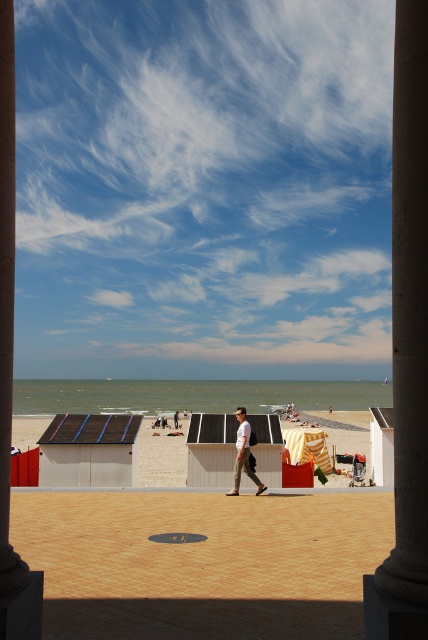
Who is taller, smooth concrete pillar at left or light brown leather pants at center?

Standing taller between the two is smooth concrete pillar at left.

Is smooth concrete pillar at left shorter than light brown leather pants at center?

In fact, smooth concrete pillar at left may be taller than light brown leather pants at center.

The height and width of the screenshot is (640, 428). In order to click on smooth concrete pillar at left in this screenshot , I will do `click(11, 364)`.

The image size is (428, 640). In order to click on smooth concrete pillar at left in this screenshot , I will do `click(11, 364)`.

Can you confirm if dark gray solar panel at center is thinner than light brown leather pants at center?

Incorrect, dark gray solar panel at center's width is not less than light brown leather pants at center's.

Is point (109, 464) in front of point (240, 461)?

No, it is not.

Does point (85, 474) lie in front of point (238, 410)?

No, it is not.

What are the coordinates of `dark gray solar panel at center` in the screenshot? It's located at (89, 451).

Between brown stone pillar at center and smooth concrete pillar at left, which one has more height?

brown stone pillar at center is taller.

Does point (424, 246) lie in front of point (11, 632)?

No.

Where is `brown stone pillar at center`? The image size is (428, 640). brown stone pillar at center is located at coordinates (407, 342).